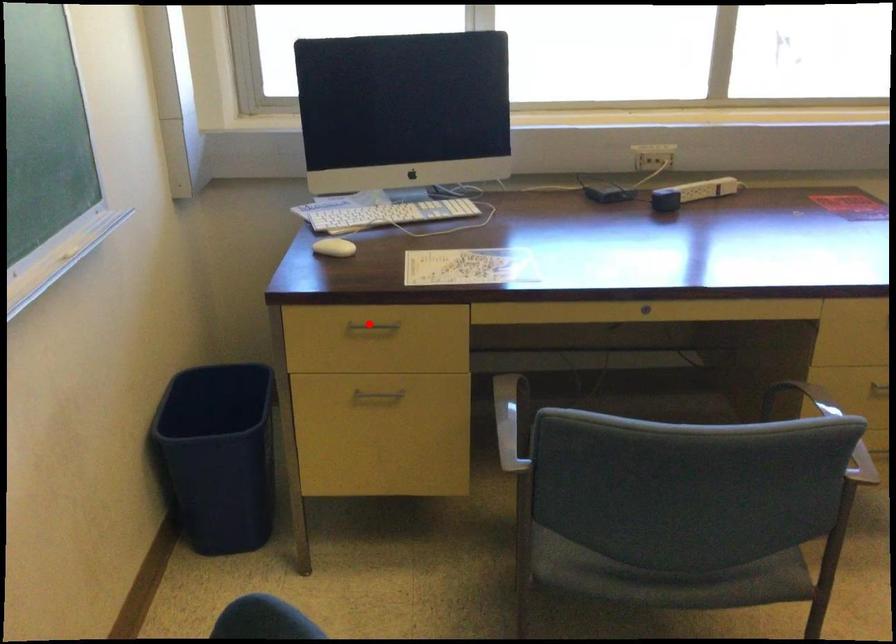
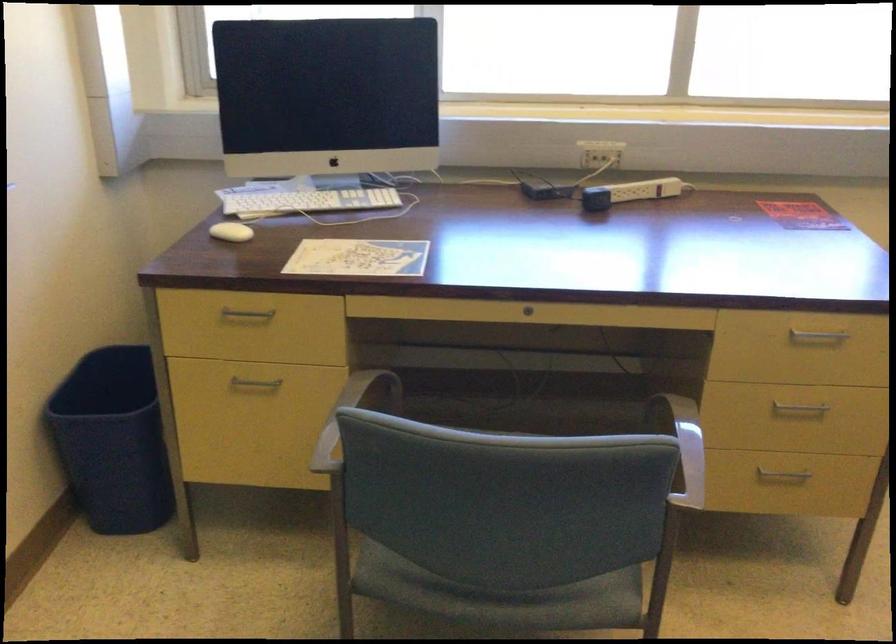
Locate, in the second image, the point that corresponds to the highlighted location in the first image.

(247, 313)